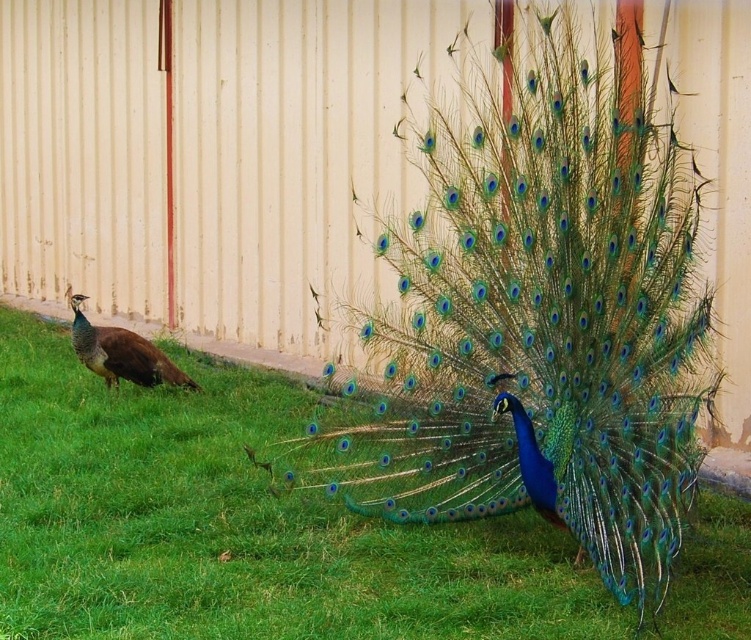
How distant is green grass at lower left from matte brown peacock at left?

The distance of green grass at lower left from matte brown peacock at left is 1.89 meters.

Who is higher up, green grass at lower left or matte brown peacock at left?

matte brown peacock at left is higher up.

Is point (68, 612) more distant than point (116, 378)?

No, (68, 612) is closer to viewer.

I want to click on green grass at lower left, so click(x=234, y=524).

Is point (653, 282) closer to camera compared to point (122, 355)?

Yes, point (653, 282) is closer to viewer.

Based on the photo, who is taller, shiny blue peacock at center or matte brown peacock at left?

shiny blue peacock at center is taller.

Is point (638, 317) closer to camera compared to point (187, 385)?

Yes, point (638, 317) is closer to viewer.

Find the location of a particular element. shiny blue peacock at center is located at coordinates (535, 316).

Does shiny blue peacock at center appear over green grass at lower left?

Yes.

Image resolution: width=751 pixels, height=640 pixels. What do you see at coordinates (535, 316) in the screenshot? I see `shiny blue peacock at center` at bounding box center [535, 316].

Who is more distant from viewer, (644, 301) or (466, 588)?

The point (466, 588) is more distant.

You are a GUI agent. You are given a task and a screenshot of the screen. Output one action in this format:
    pyautogui.click(x=<x>, y=<y>)
    Task: Click on the shiny blue peacock at center
    
    Given the screenshot: What is the action you would take?
    pyautogui.click(x=535, y=316)